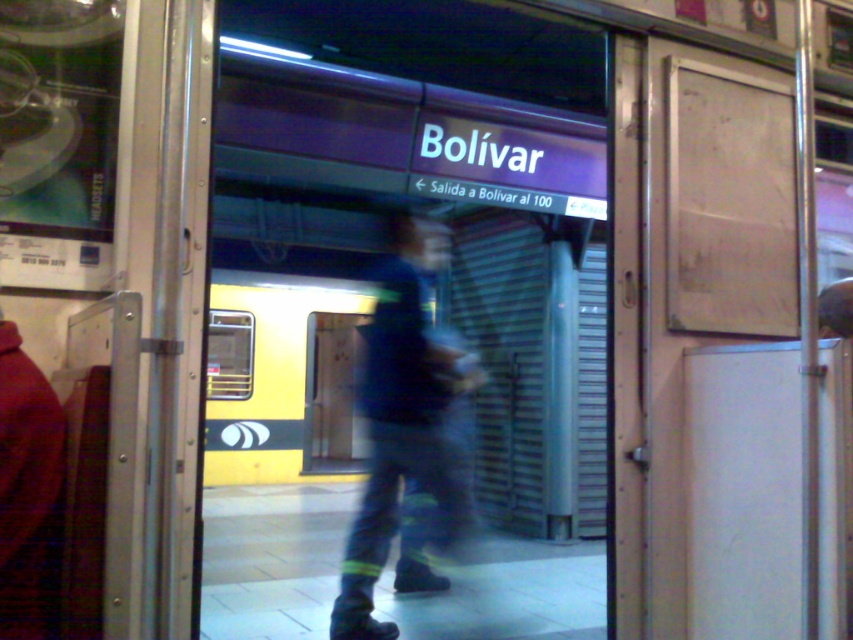
Question: Where is white matte door at right located in relation to blue fabric pants at center in the image?

Choices:
 (A) above
 (B) below

Answer: (A)

Question: Does white matte door at right appear under blue fabric pants at center?

Choices:
 (A) yes
 (B) no

Answer: (B)

Question: Can you confirm if white matte door at right is bigger than blue fabric pants at center?

Choices:
 (A) yes
 (B) no

Answer: (B)

Question: Among these objects, which one is nearest to the camera?

Choices:
 (A) blue fabric pants at center
 (B) white matte door at right

Answer: (B)

Question: Which point is closer to the camera taking this photo?

Choices:
 (A) (653, 579)
 (B) (372, 336)

Answer: (A)

Question: Among these objects, which one is nearest to the camera?

Choices:
 (A) white matte door at right
 (B) blue fabric pants at center

Answer: (A)